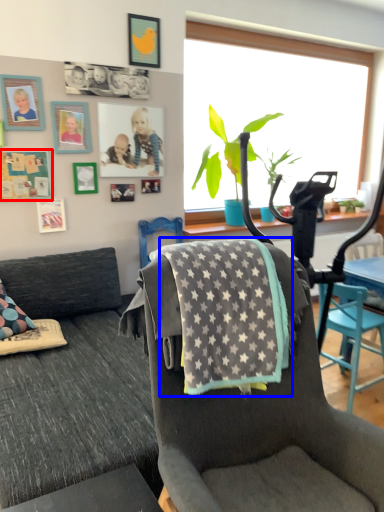
Question: Which point is closer to the camera, picture frame (highlighted by a red box) or blanket (highlighted by a blue box)?

Choices:
 (A) picture frame
 (B) blanket

Answer: (B)